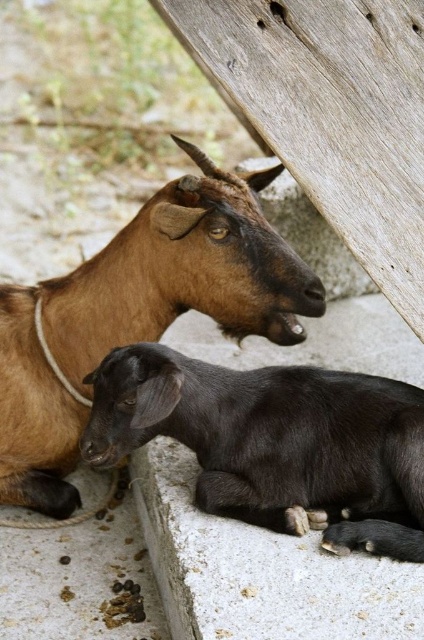
Does brown matte goat at center have a greater height compared to black matte goat at lower center?

Yes, brown matte goat at center is taller than black matte goat at lower center.

Consider the image. Can you confirm if brown matte goat at center is wider than black matte goat at lower center?

Indeed, brown matte goat at center has a greater width compared to black matte goat at lower center.

You are a GUI agent. You are given a task and a screenshot of the screen. Output one action in this format:
    pyautogui.click(x=<x>, y=<y>)
    Task: Click on the brown matte goat at center
    
    Given the screenshot: What is the action you would take?
    pyautogui.click(x=137, y=314)